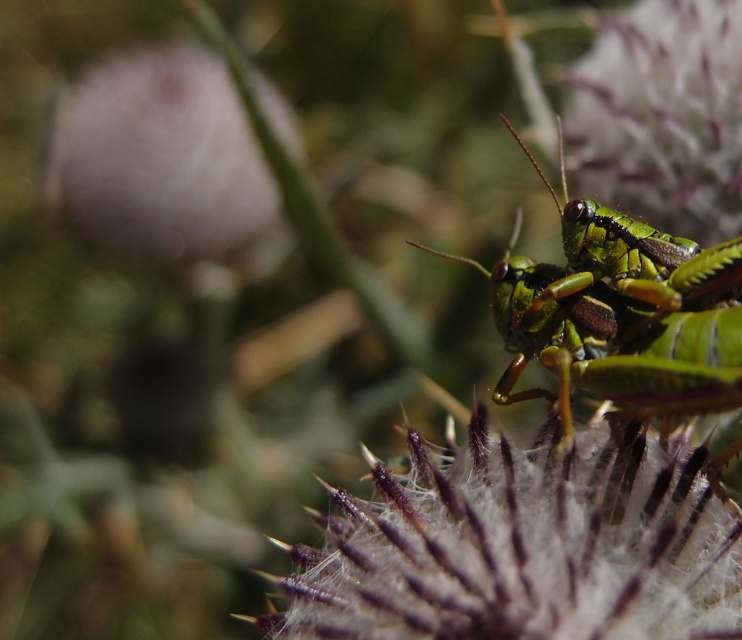
Question: Where is fuzzy white flower at center located in relation to green matte grasshopper at upper right in the image?

Choices:
 (A) left
 (B) right

Answer: (A)

Question: Which object appears closest to the camera in this image?

Choices:
 (A) fuzzy white flower at center
 (B) fuzzy white flower at upper left

Answer: (A)

Question: Which point is farther to the camera?

Choices:
 (A) fuzzy white flower at center
 (B) green matte grasshopper at upper right
 (C) green metallic grasshopper at center

Answer: (B)

Question: Is fuzzy white flower at center smaller than green metallic grasshopper at center?

Choices:
 (A) no
 (B) yes

Answer: (B)

Question: Estimate the real-world distances between objects in this image. Which object is farther from the fuzzy white flower at center?

Choices:
 (A) fuzzy white flower at upper left
 (B) green metallic grasshopper at center

Answer: (A)

Question: Considering the relative positions of fuzzy white flower at center and green metallic grasshopper at center in the image provided, where is fuzzy white flower at center located with respect to green metallic grasshopper at center?

Choices:
 (A) right
 (B) left

Answer: (B)